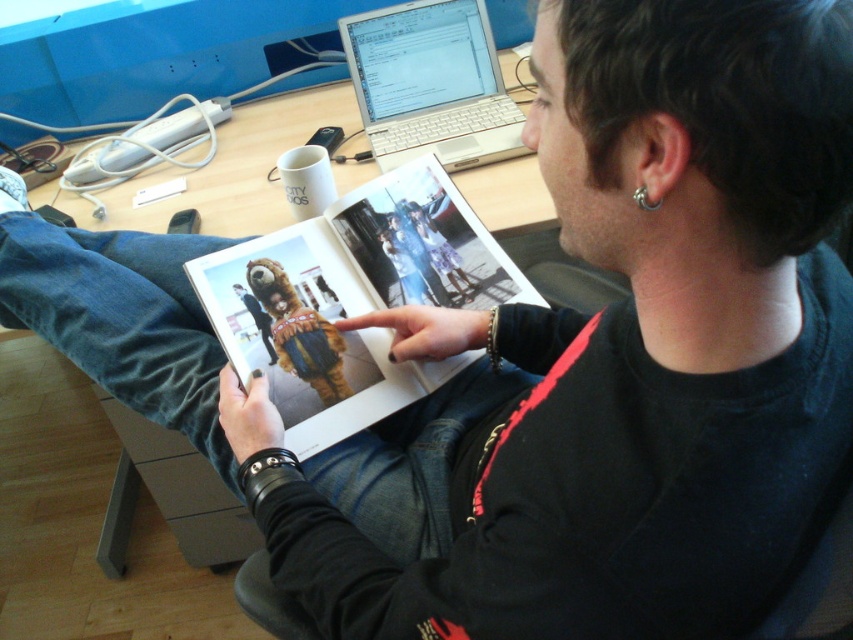
Between wooden at upper center and silver metallic ring at ear, which one has more height?

wooden at upper center

Image resolution: width=853 pixels, height=640 pixels. Describe the element at coordinates (227, 168) in the screenshot. I see `wooden at upper center` at that location.

Where is `wooden at upper center`? This screenshot has width=853, height=640. wooden at upper center is located at coordinates (227, 168).

The height and width of the screenshot is (640, 853). What are the coordinates of `matte paper magazine at center` in the screenshot? It's located at (352, 300).

Does point (276, 234) come closer to viewer compared to point (469, 173)?

Yes.

What are the coordinates of `matte paper magazine at center` in the screenshot? It's located at (352, 300).

How much distance is there between matte paper magazine at center and silver metallic ring at ear?

matte paper magazine at center is 56.36 centimeters from silver metallic ring at ear.

Is matte paper magazine at center positioned at the back of silver metallic ring at ear?

Yes, it is.

Image resolution: width=853 pixels, height=640 pixels. I want to click on matte paper magazine at center, so click(352, 300).